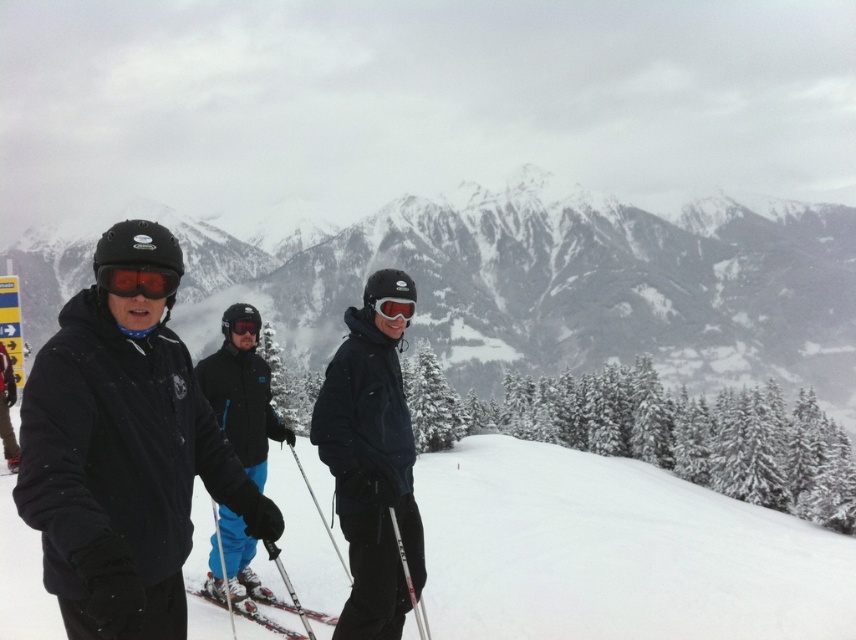
Consider the image. You are a photographer standing at the ski resort and want to capture a photo of both the snowy mountain at center and the glossy plastic goggles at center. Based on their positions, which object is located to the right of the other?

The snowy mountain at center is positioned on the right side of glossy plastic goggles at center, so the snowy mountain at center is to the right of the glossy plastic goggles at center.

You are a photographer wanting to capture a wide shot of the snowy mountain at center and the glossy plastic goggles at center. Which object will appear bigger in your photo?

The snowy mountain at center will appear bigger in the photo because it is larger in size than the glossy plastic goggles at center.